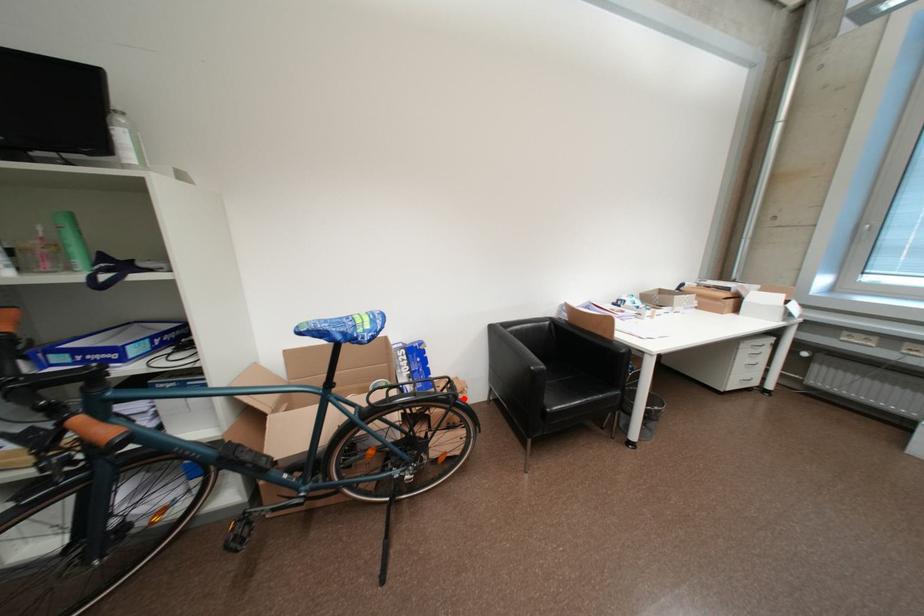
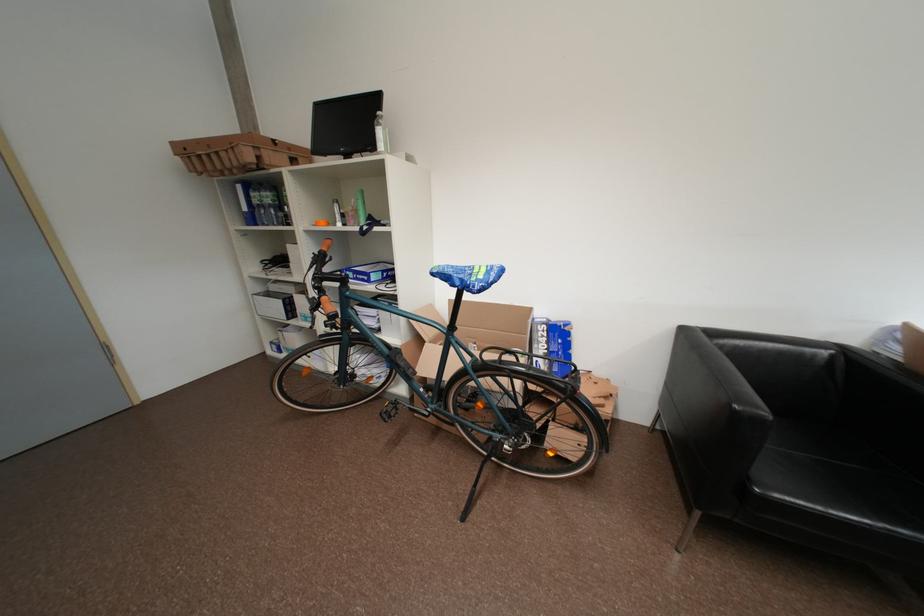
Question: I am providing you with two images of the same scene from different viewpoints. Image1 has a red point marked. In image2, the corresponding 3D location appears at what relative position? Reply with the corresponding letter.

Choices:
 (A) Closer
 (B) Farther

Answer: (B)